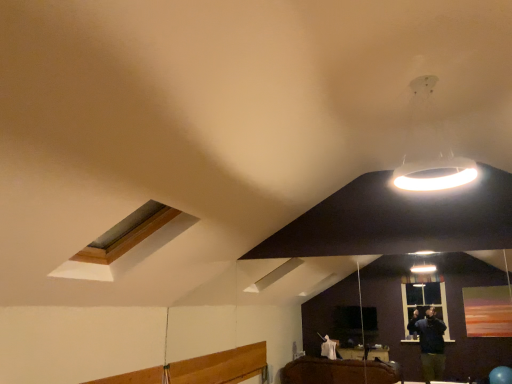
Question: Is white glossy ring light at upper right located outside wooden-framed skylight at upper left?

Choices:
 (A) yes
 (B) no

Answer: (A)

Question: Is white glossy ring light at upper right taller than wooden-framed skylight at upper left?

Choices:
 (A) no
 (B) yes

Answer: (B)

Question: Considering the relative sizes of white glossy ring light at upper right and wooden-framed skylight at upper left in the image provided, is white glossy ring light at upper right wider than wooden-framed skylight at upper left?

Choices:
 (A) no
 (B) yes

Answer: (A)

Question: From the image's perspective, does white glossy ring light at upper right appear lower than wooden-framed skylight at upper left?

Choices:
 (A) no
 (B) yes

Answer: (A)

Question: Is white glossy ring light at upper right positioned far away from wooden-framed skylight at upper left?

Choices:
 (A) yes
 (B) no

Answer: (A)

Question: Would you say white glossy ring light at upper right contains wooden-framed skylight at upper left?

Choices:
 (A) no
 (B) yes

Answer: (A)

Question: From a real-world perspective, is wooden-framed skylight at upper left located beneath white glossy ring light at upper right?

Choices:
 (A) yes
 (B) no

Answer: (A)

Question: Does wooden-framed skylight at upper left have a smaller size compared to white glossy ring light at upper right?

Choices:
 (A) no
 (B) yes

Answer: (A)

Question: Considering the relative sizes of wooden-framed skylight at upper left and white glossy ring light at upper right in the image provided, is wooden-framed skylight at upper left taller than white glossy ring light at upper right?

Choices:
 (A) yes
 (B) no

Answer: (B)

Question: From the image's perspective, is wooden-framed skylight at upper left on top of white glossy ring light at upper right?

Choices:
 (A) yes
 (B) no

Answer: (B)

Question: Is wooden-framed skylight at upper left oriented away from white glossy ring light at upper right?

Choices:
 (A) no
 (B) yes

Answer: (A)

Question: Does wooden-framed skylight at upper left have a larger size compared to white glossy ring light at upper right?

Choices:
 (A) yes
 (B) no

Answer: (A)

Question: In terms of width, does white glossy ring light at upper right look wider or thinner when compared to wooden-framed skylight at upper left?

Choices:
 (A) thin
 (B) wide

Answer: (A)